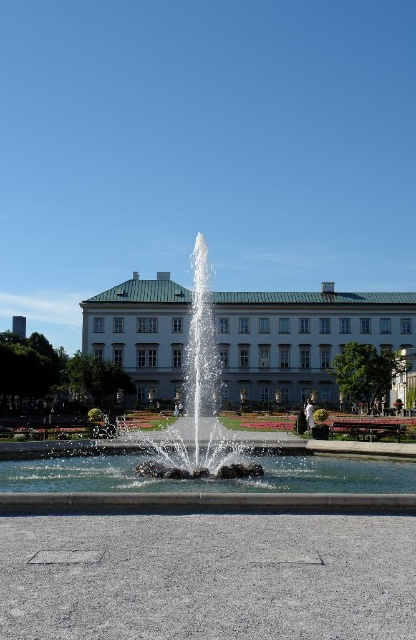
Question: Which point appears closest to the camera in this image?

Choices:
 (A) (138, 340)
 (B) (52, 499)

Answer: (B)

Question: Which of the following is the closest to the observer?

Choices:
 (A) white smooth building at center
 (B) white stone fountain at center

Answer: (B)

Question: Is white smooth building at center in front of white stone fountain at center?

Choices:
 (A) no
 (B) yes

Answer: (A)

Question: Can you confirm if white smooth building at center is wider than white stone fountain at center?

Choices:
 (A) yes
 (B) no

Answer: (A)

Question: Does white smooth building at center appear on the right side of white stone fountain at center?

Choices:
 (A) yes
 (B) no

Answer: (A)

Question: Which point is closer to the camera taking this photo?

Choices:
 (A) (9, 504)
 (B) (86, 348)

Answer: (A)